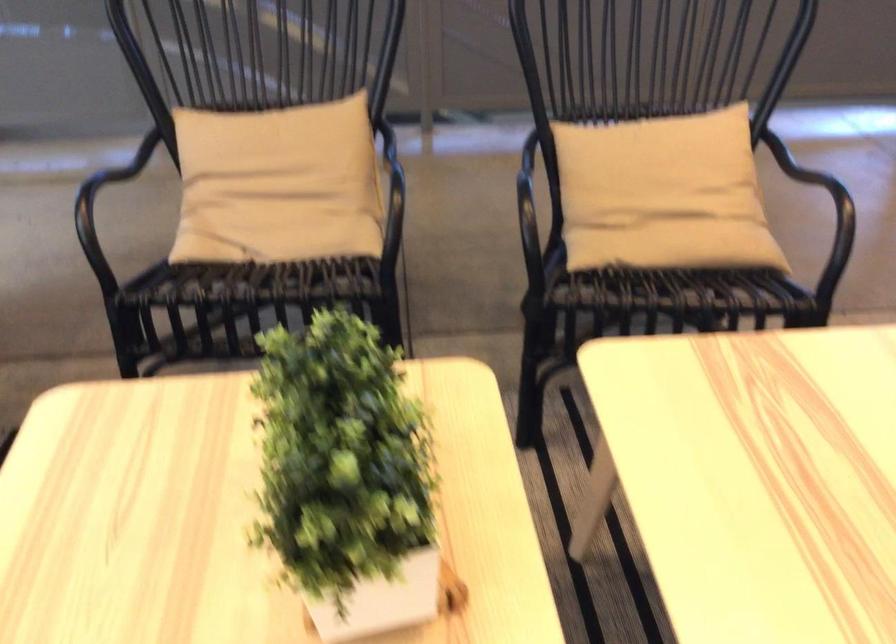
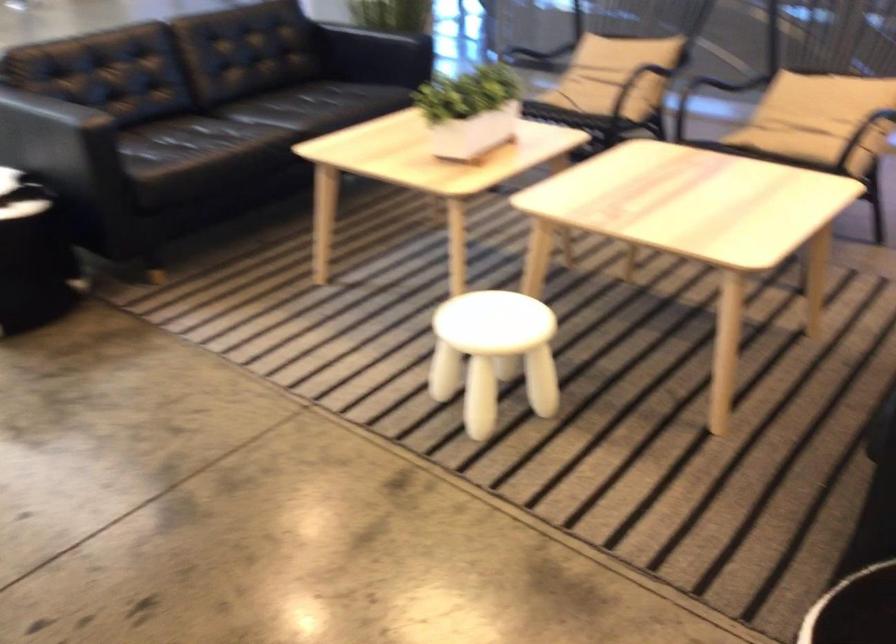
The point at (415, 486) is marked in the first image. Where is the corresponding point in the second image?

(470, 111)